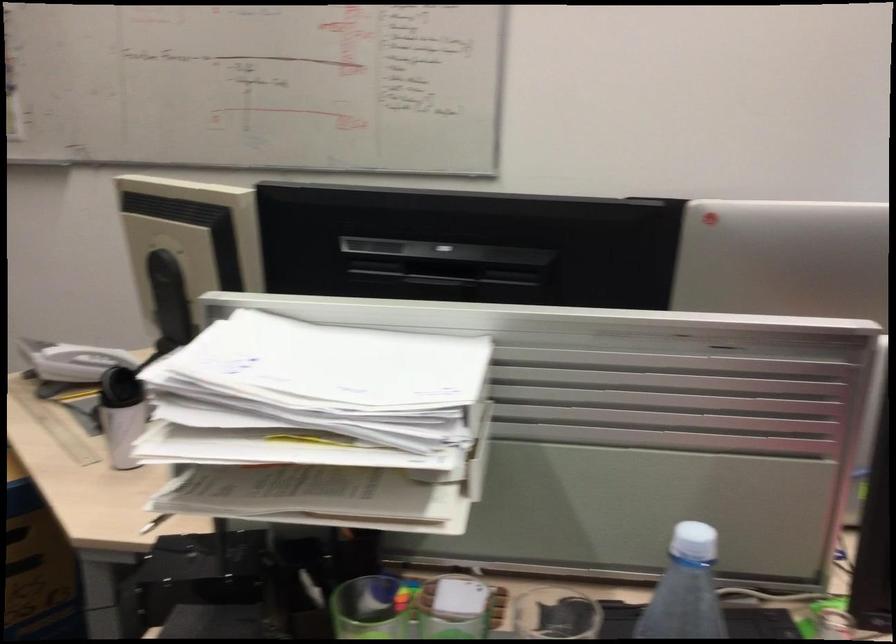
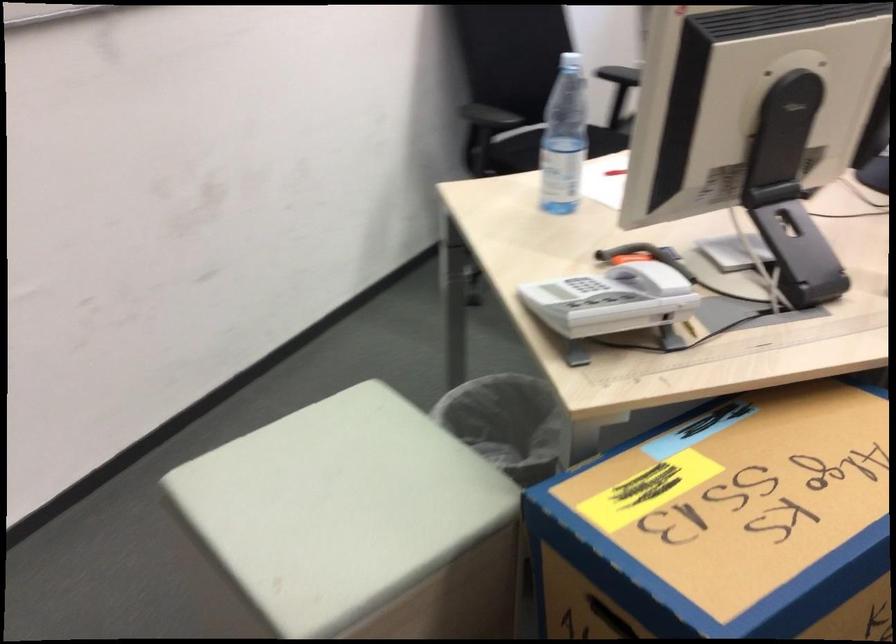
Where in the second image is the point corresponding to (x=73, y=418) from the first image?

(746, 334)